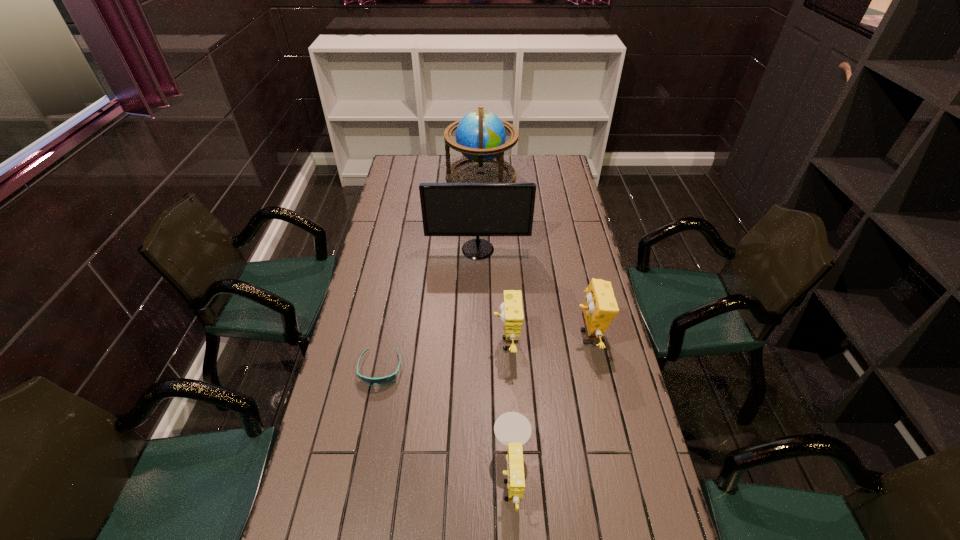
Find the location of a particular element. The width and height of the screenshot is (960, 540). vacant space positioned on the face of the rightmost object is located at coordinates [x=512, y=336].

Find the location of `vacant position located on the face of the rightmost object`. vacant position located on the face of the rightmost object is located at coordinates (554, 336).

Where is `vacant space located 0.270m on the face of the rightmost object`? vacant space located 0.270m on the face of the rightmost object is located at coordinates pyautogui.click(x=491, y=336).

Locate an element on the screen. The width and height of the screenshot is (960, 540). free region located 0.060m on the front-facing side of the nearest object is located at coordinates (470, 477).

This screenshot has height=540, width=960. Identify the location of vacant space located 0.330m on the front-facing side of the nearest object. (366, 477).

Image resolution: width=960 pixels, height=540 pixels. I want to click on blank space located on the front-facing side of the nearest object, so click(357, 477).

At what (x,y) coordinates should I click in order to perform the action: click on free spot located 0.150m on the front-facing side of the sunglasses. Please return your answer as a coordinate pair (x, y). This screenshot has width=960, height=540. Looking at the image, I should click on (368, 436).

You are a GUI agent. You are given a task and a screenshot of the screen. Output one action in this format:
    pyautogui.click(x=<x>, y=<y>)
    Task: Click on the object that is positioned at the far edge
    Image resolution: width=960 pixels, height=540 pixels.
    Given the screenshot: What is the action you would take?
    pyautogui.click(x=480, y=135)

What are the coordinates of `object at the left edge` in the screenshot? It's located at (382, 381).

Identify the location of object that is at the right edge. The height and width of the screenshot is (540, 960). tap(600, 307).